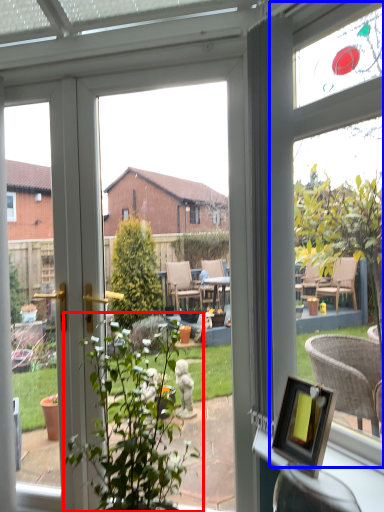
Question: Which point is further to the camera, houseplant (highlighted by a red box) or bay window (highlighted by a blue box)?

Choices:
 (A) houseplant
 (B) bay window

Answer: (B)